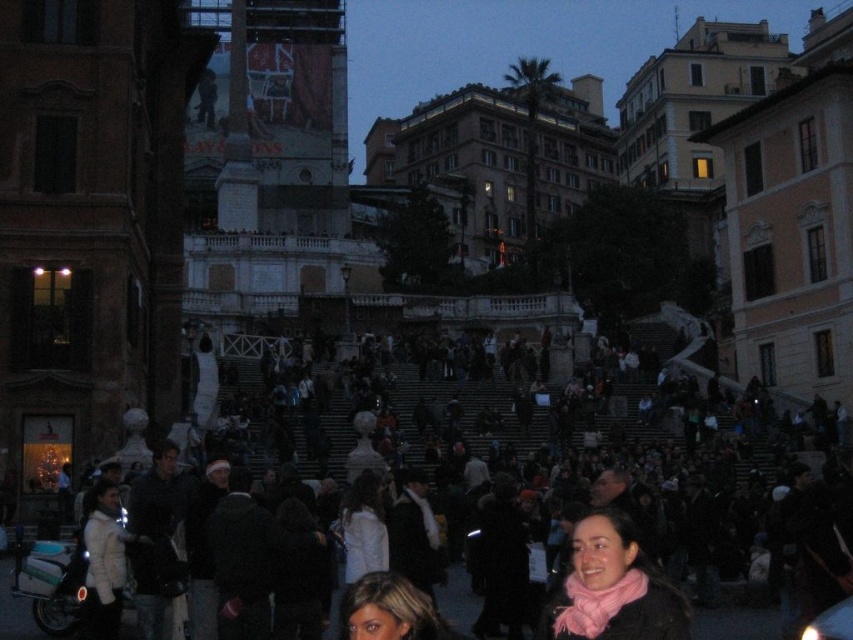
Question: Is pink scarf at lower center below blonde hair at center?

Choices:
 (A) yes
 (B) no

Answer: (B)

Question: Estimate the real-world distances between objects in this image. Which object is farther from the pink scarf at lower center?

Choices:
 (A) blonde hair at center
 (B) dark clothing crowd at center

Answer: (B)

Question: Does dark clothing crowd at center lie in front of pink scarf at lower center?

Choices:
 (A) yes
 (B) no

Answer: (B)

Question: Which is nearer to the blonde hair at center?

Choices:
 (A) dark clothing crowd at center
 (B) pink scarf at lower center

Answer: (B)

Question: Is dark clothing crowd at center above blonde hair at center?

Choices:
 (A) yes
 (B) no

Answer: (A)

Question: Which of these objects is positioned closest to the blonde hair at center?

Choices:
 (A) pink scarf at lower center
 (B) dark clothing crowd at center

Answer: (A)